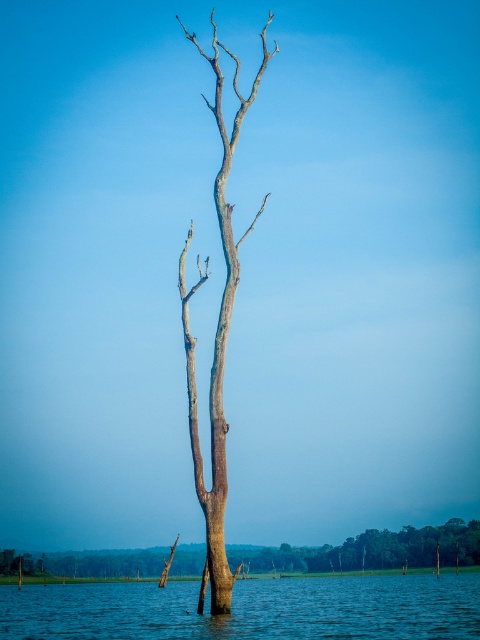
Who is taller, blue liquid water at center or brown rough tree trunk at center?

blue liquid water at center

Is blue liquid water at center above brown rough tree trunk at center?

Correct, blue liquid water at center is located above brown rough tree trunk at center.

Locate an element on the screen. This screenshot has width=480, height=640. blue liquid water at center is located at coordinates (250, 609).

Which is more to the right, brown rough tree trunk at center or smooth gray bark tree at center?

smooth gray bark tree at center

Where is `brown rough tree trunk at center`? brown rough tree trunk at center is located at coordinates (371, 548).

I want to click on brown rough tree trunk at center, so point(371,548).

Can you confirm if blue liquid water at center is shorter than smooth gray bark tree at center?

Yes, blue liquid water at center is shorter than smooth gray bark tree at center.

Between point (116, 627) and point (220, 80), which one is positioned in front?

Positioned in front is point (220, 80).

From the picture: Who is more forward, (25, 634) or (216, 38)?

Point (25, 634) is in front.

Locate an element on the screen. The image size is (480, 640). blue liquid water at center is located at coordinates (250, 609).